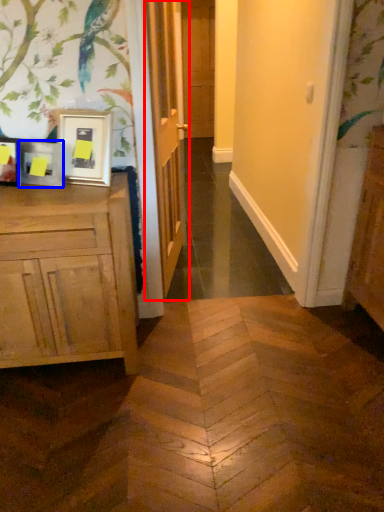
Question: Which object appears closest to the camera in this image, door (highlighted by a red box) or picture frame (highlighted by a blue box)?

Choices:
 (A) door
 (B) picture frame

Answer: (B)